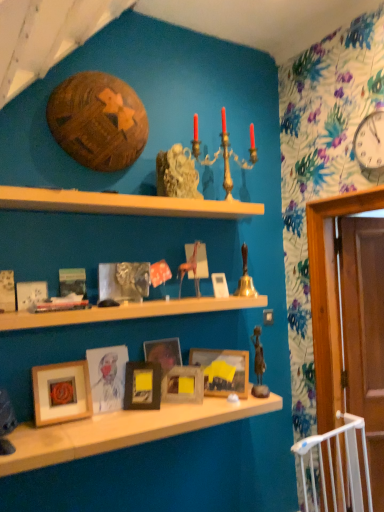
Find the location of a particular element. The height and width of the screenshot is (512, 384). empty space that is ontop of wooden shelf at lower center, the first shelf when ordered from bottom to top (from a real-world perspective) is located at coordinates coord(128,418).